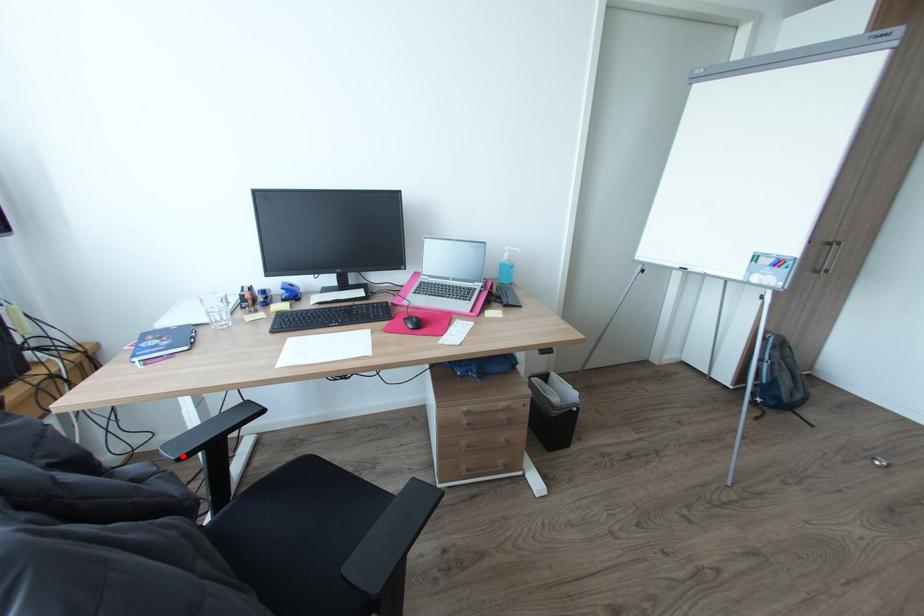
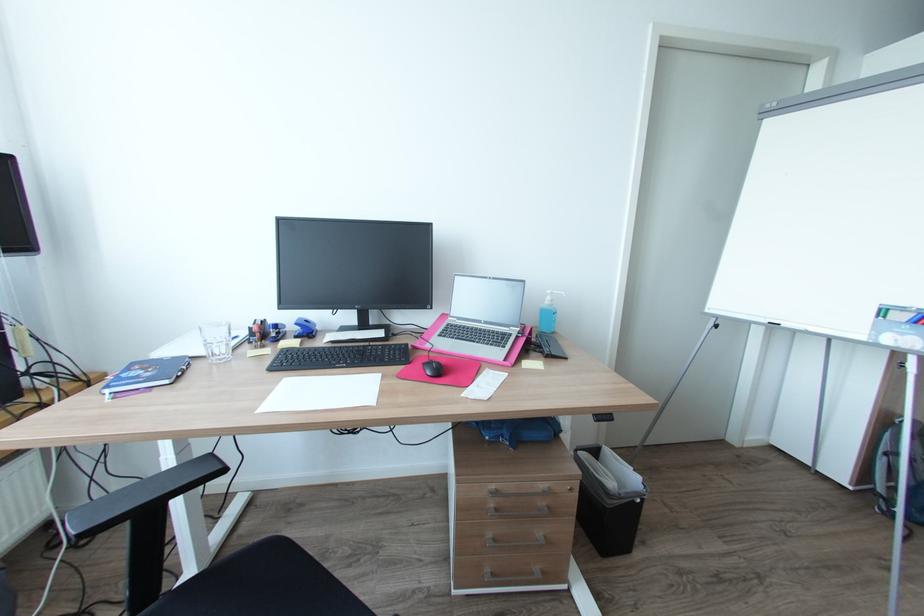
Where in the second image is the point corresponding to the highlighted location from the first image?

(86, 531)